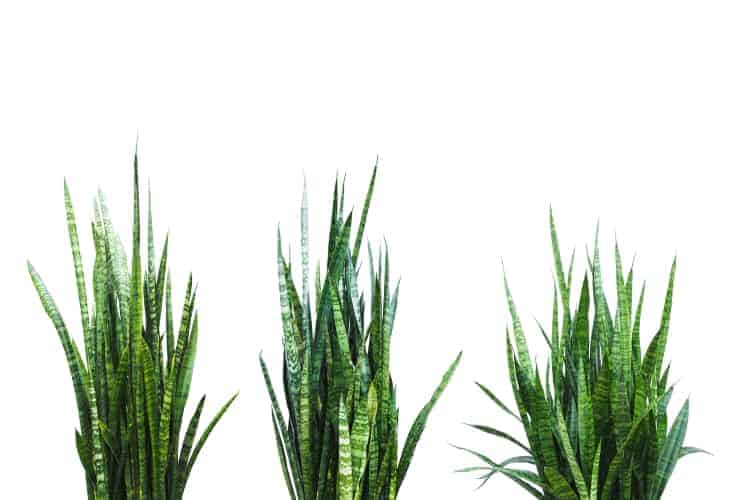
You are a GUI agent. You are given a task and a screenshot of the screen. Output one action in this format:
    pyautogui.click(x=<x>, y=<y>)
    Task: Click on the plant
    The image size is (750, 500).
    Given the screenshot: What is the action you would take?
    pyautogui.click(x=115, y=317), pyautogui.click(x=327, y=408), pyautogui.click(x=583, y=393)